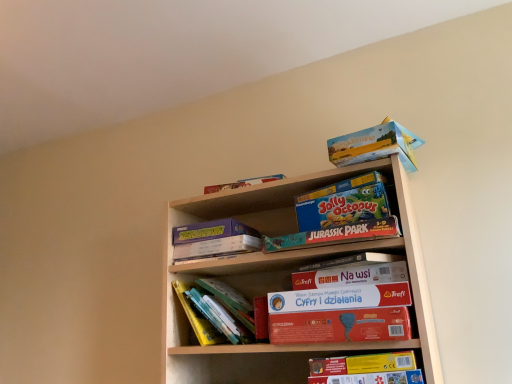
Question: Are matte cardboard box at upper right and blue cardboard jolly octopus board game at center, the first paperback book in the top-to-bottom sequence, making contact?

Choices:
 (A) no
 (B) yes

Answer: (A)

Question: Is matte cardboard box at upper right at the right side of blue cardboard jolly octopus board game at center, which appears as the 5th paperback book when ordered from the bottom?

Choices:
 (A) yes
 (B) no

Answer: (A)

Question: From a real-world perspective, is matte cardboard box at upper right positioned under blue cardboard jolly octopus board game at center, the first paperback book in the top-to-bottom sequence, based on gravity?

Choices:
 (A) no
 (B) yes

Answer: (A)

Question: Considering the relative positions of matte cardboard box at upper right and blue cardboard jolly octopus board game at center, the first paperback book in the top-to-bottom sequence, in the image provided, is matte cardboard box at upper right behind blue cardboard jolly octopus board game at center, the first paperback book in the top-to-bottom sequence,?

Choices:
 (A) no
 (B) yes

Answer: (B)

Question: Considering the relative sizes of matte cardboard box at upper right and blue cardboard jolly octopus board game at center, which appears as the 5th paperback book when ordered from the bottom, in the image provided, is matte cardboard box at upper right thinner than blue cardboard jolly octopus board game at center, which appears as the 5th paperback book when ordered from the bottom,?

Choices:
 (A) yes
 (B) no

Answer: (A)

Question: Relative to matte purple book at upper center, marked as the 3th paperback book in a bottom-to-top arrangement, is matte cardboard box at upper right in front or behind?

Choices:
 (A) behind
 (B) front

Answer: (B)

Question: From the image's perspective, relative to matte purple book at upper center, positioned as the 3th paperback book in top-to-bottom order, is matte cardboard box at upper right above or below?

Choices:
 (A) below
 (B) above

Answer: (B)

Question: In the image, is matte cardboard box at upper right on the left side or the right side of matte purple book at upper center, positioned as the 3th paperback book in top-to-bottom order?

Choices:
 (A) right
 (B) left

Answer: (A)

Question: In terms of width, does matte cardboard box at upper right look wider or thinner when compared to matte purple book at upper center, marked as the 3th paperback book in a bottom-to-top arrangement?

Choices:
 (A) wide
 (B) thin

Answer: (B)

Question: From a real-world perspective, relative to yellow cardboard book at lower right, placed as the first book when sorted from right to left, is blue cardboard jolly octopus board game at center, which appears as the 5th paperback book when ordered from the bottom, vertically above or below?

Choices:
 (A) below
 (B) above

Answer: (B)

Question: Considering their positions, is blue cardboard jolly octopus board game at center, which appears as the 5th paperback book when ordered from the bottom, located in front of or behind yellow cardboard book at lower right, marked as the second book in a back-to-front arrangement?

Choices:
 (A) behind
 (B) front

Answer: (A)

Question: In terms of height, does blue cardboard jolly octopus board game at center, which appears as the 5th paperback book when ordered from the bottom, look taller or shorter compared to yellow cardboard book at lower right, acting as the first book starting from the front?

Choices:
 (A) short
 (B) tall

Answer: (B)

Question: Is point (378, 196) positioned closer to the camera than point (357, 379)?

Choices:
 (A) farther
 (B) closer

Answer: (A)

Question: Considering the positions of point (306, 332) and point (365, 380), is point (306, 332) closer or farther from the camera than point (365, 380)?

Choices:
 (A) farther
 (B) closer

Answer: (A)

Question: Which is correct: red matte board game at center, acting as the 1th paperback book starting from the bottom, is inside yellow cardboard book at lower right, marked as the second book in a back-to-front arrangement, or outside of it?

Choices:
 (A) outside
 (B) inside

Answer: (A)